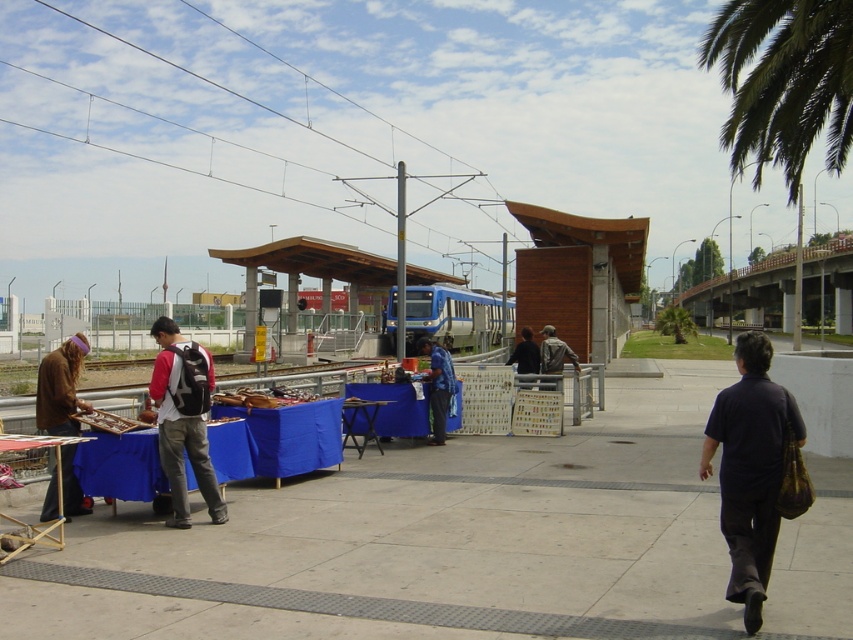
Is blue metallic train at center shorter than dark blue shirt at center?

In fact, blue metallic train at center may be taller than dark blue shirt at center.

Which is in front, point (395, 288) or point (527, 365)?

Positioned in front is point (527, 365).

Where is `blue metallic train at center`? The image size is (853, 640). blue metallic train at center is located at coordinates (451, 316).

Can you confirm if matte black backpack at center is taller than dark gray jacket at center?

No.

Which is above, matte black backpack at center or dark gray jacket at center?

dark gray jacket at center

Which is behind, point (175, 444) or point (556, 355)?

Point (556, 355)

The height and width of the screenshot is (640, 853). I want to click on matte black backpack at center, so click(183, 422).

Who is more forward, (756,540) or (181,512)?

Point (756,540) is more forward.

Who is more forward, (722, 467) or (181, 360)?

Point (722, 467)

Where is `dark blue shirt at right`? This screenshot has width=853, height=640. dark blue shirt at right is located at coordinates (750, 468).